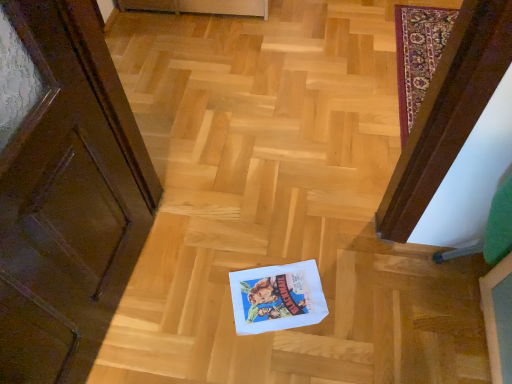
What is the approximate width of carpeted mat at upper right?

14.15 inches.

At what (x,y) coordinates should I click in order to perform the action: click on carpeted mat at upper right. Please return your answer as a coordinate pair (x, y). The width and height of the screenshot is (512, 384). Looking at the image, I should click on (418, 55).

What do you see at coordinates (418, 55) in the screenshot? I see `carpeted mat at upper right` at bounding box center [418, 55].

Where is `carpeted mat at upper right`? This screenshot has width=512, height=384. carpeted mat at upper right is located at coordinates (418, 55).